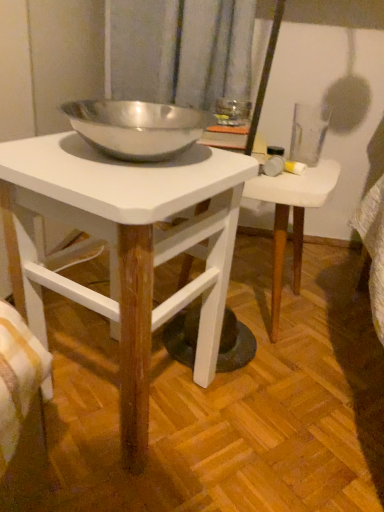
Question: From a real-world perspective, is white matte table at center, which is the first table from front to back, positioned above or below white wood table at center, positioned as the second table in front-to-back order?

Choices:
 (A) below
 (B) above

Answer: (B)

Question: Is white matte table at center, which is the first table from front to back, taller or shorter than white wood table at center, which is the first table in back-to-front order?

Choices:
 (A) short
 (B) tall

Answer: (B)

Question: Considering the positions of point (125, 197) and point (292, 267), is point (125, 197) closer or farther from the camera than point (292, 267)?

Choices:
 (A) farther
 (B) closer

Answer: (B)

Question: Is point (276, 266) closer or farther from the camera than point (243, 176)?

Choices:
 (A) farther
 (B) closer

Answer: (A)

Question: In terms of height, does white wood table at center, positioned as the second table in front-to-back order, look taller or shorter compared to white matte table at center, which is the first table from front to back?

Choices:
 (A) short
 (B) tall

Answer: (A)

Question: In the image, is white wood table at center, positioned as the second table in front-to-back order, positioned in front of or behind white matte table at center, which is counted as the 2th table, starting from the back?

Choices:
 (A) front
 (B) behind

Answer: (B)

Question: Is white wood table at center, which is the first table in back-to-front order, spatially inside white matte table at center, which is the first table from front to back, or outside of it?

Choices:
 (A) inside
 (B) outside

Answer: (B)